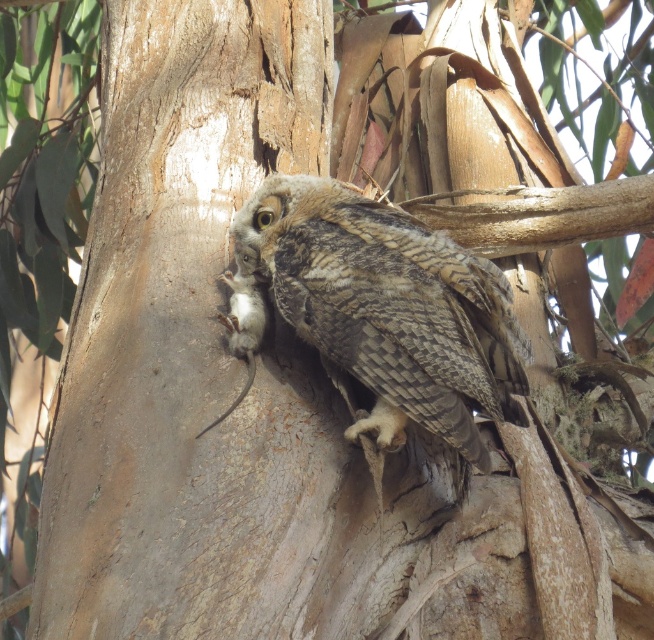
Does smooth brown bark at center have a smaller size compared to camouflage feathered owl at center?

Actually, smooth brown bark at center might be larger than camouflage feathered owl at center.

Does smooth brown bark at center appear over camouflage feathered owl at center?

Correct, smooth brown bark at center is located above camouflage feathered owl at center.

Describe the element at coordinates (186, 342) in the screenshot. I see `smooth brown bark at center` at that location.

At what (x,y) coordinates should I click in order to perform the action: click on smooth brown bark at center. Please return your answer as a coordinate pair (x, y). This screenshot has height=640, width=654. Looking at the image, I should click on (186, 342).